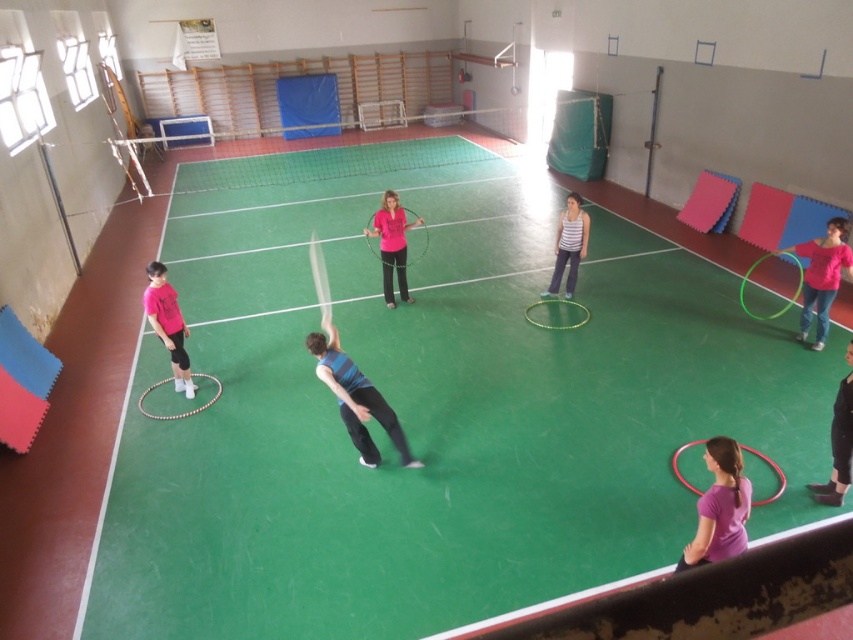
Question: Which object appears farthest from the camera in this image?

Choices:
 (A) matte pink hula hoop at lower left
 (B) black matte pants at lower right
 (C) striped fabric hula hoop at center

Answer: (C)

Question: Considering the real-world distances, which object is closest to the pink matte hula hoop at center?

Choices:
 (A) matte pink hula hoop at lower left
 (B) black matte pants at lower right

Answer: (A)

Question: Can you confirm if blue striped shirt at center is bigger than pink matte hula hoop at center?

Choices:
 (A) yes
 (B) no

Answer: (B)

Question: Which object is positioned closest to the pink matte hula hoop at center?

Choices:
 (A) pink fabric hula hoop at right
 (B) striped fabric hula hoop at center

Answer: (B)

Question: Is matte pink hula hoop at lower left closer to the viewer compared to pink matte hula hoop at center?

Choices:
 (A) no
 (B) yes

Answer: (B)

Question: Does pink fabric hula hoop at right appear over striped fabric hula hoop at center?

Choices:
 (A) yes
 (B) no

Answer: (B)